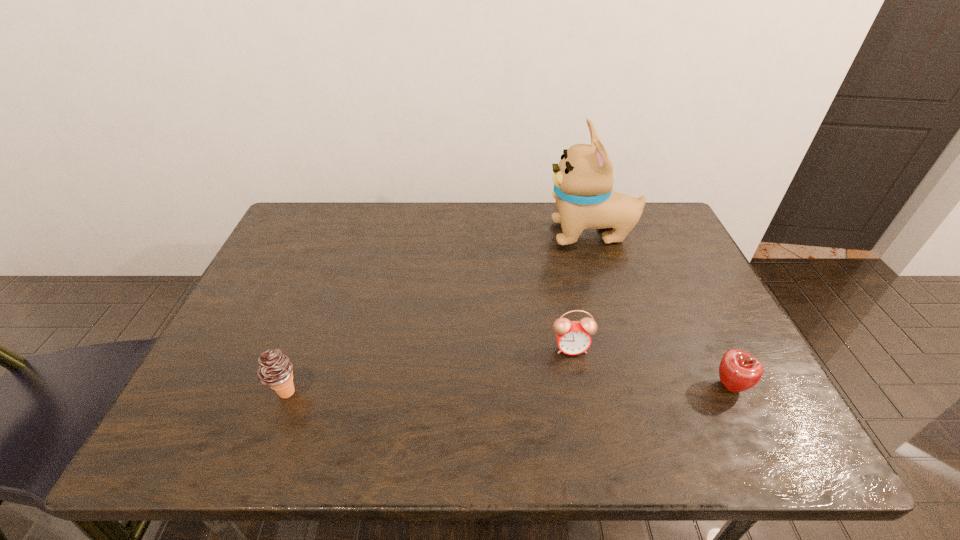
In the image, there is a desktop. What are the coordinates of `blank space at the left edge` in the screenshot? It's located at (273, 297).

Find the location of a particular element. The width and height of the screenshot is (960, 540). vacant space at the right edge is located at coordinates (641, 248).

In order to click on vacant area at the near left corner of the desktop in this screenshot , I will do `click(250, 440)`.

This screenshot has width=960, height=540. I want to click on vacant area at the near right corner, so click(x=750, y=450).

Locate an element on the screen. unoccupied position between the icecream and the third nearest object is located at coordinates (428, 370).

Where is `unoccupied position between the third shortest object and the third tallest object`? The height and width of the screenshot is (540, 960). unoccupied position between the third shortest object and the third tallest object is located at coordinates (428, 370).

The height and width of the screenshot is (540, 960). I want to click on free space between the apple and the farthest object, so click(x=660, y=310).

Locate an element on the screen. free point between the shortest object and the second shortest object is located at coordinates (650, 367).

You are a GUI agent. You are given a task and a screenshot of the screen. Output one action in this format:
    pyautogui.click(x=<x>, y=<y>)
    Task: Click on the free spot between the rightmost object and the farthest object
    
    Given the screenshot: What is the action you would take?
    pyautogui.click(x=660, y=310)

The image size is (960, 540). Find the location of `free area in between the leftmost object and the puppy`. free area in between the leftmost object and the puppy is located at coordinates (439, 313).